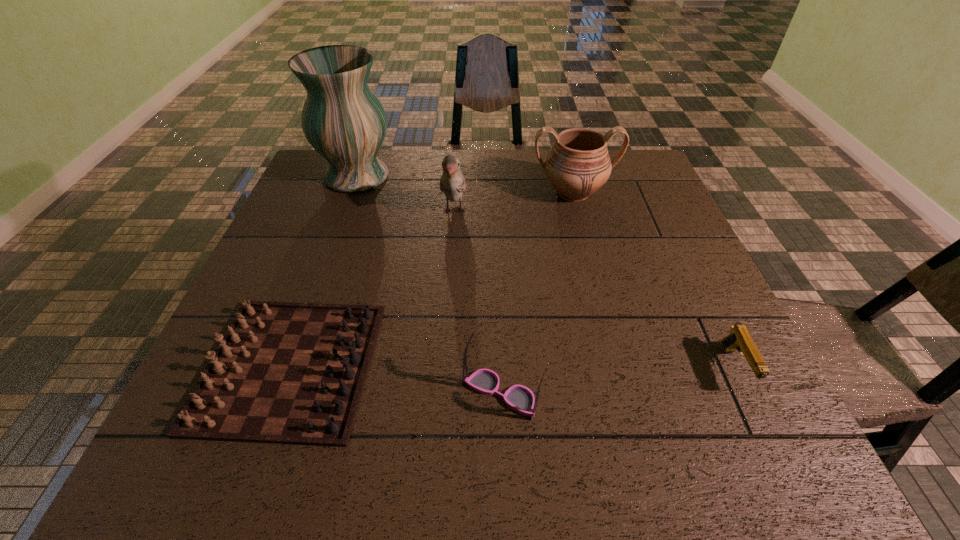
Locate an element on the screen. This screenshot has height=540, width=960. vase is located at coordinates (343, 120).

Locate an element on the screen. This screenshot has width=960, height=540. urn is located at coordinates (578, 164).

What are the coordinates of `bird` in the screenshot? It's located at (452, 183).

The height and width of the screenshot is (540, 960). I want to click on the fourth tallest object, so click(521, 399).

This screenshot has height=540, width=960. Find the location of `the fourth object from left to right`. the fourth object from left to right is located at coordinates (521, 399).

I want to click on pistol, so click(x=739, y=339).

The width and height of the screenshot is (960, 540). I want to click on chessboard, so click(292, 373).

At what (x,y) coordinates should I click in order to perform the action: click on free space located on the right of the vase. Please return your answer as a coordinate pair (x, y). Looking at the image, I should click on (461, 176).

Where is `vacant point located 0.290m on the front-facing side of the urn`? vacant point located 0.290m on the front-facing side of the urn is located at coordinates (597, 289).

This screenshot has height=540, width=960. Find the location of `free space located at the face of the fourth object from right to left`. free space located at the face of the fourth object from right to left is located at coordinates (448, 292).